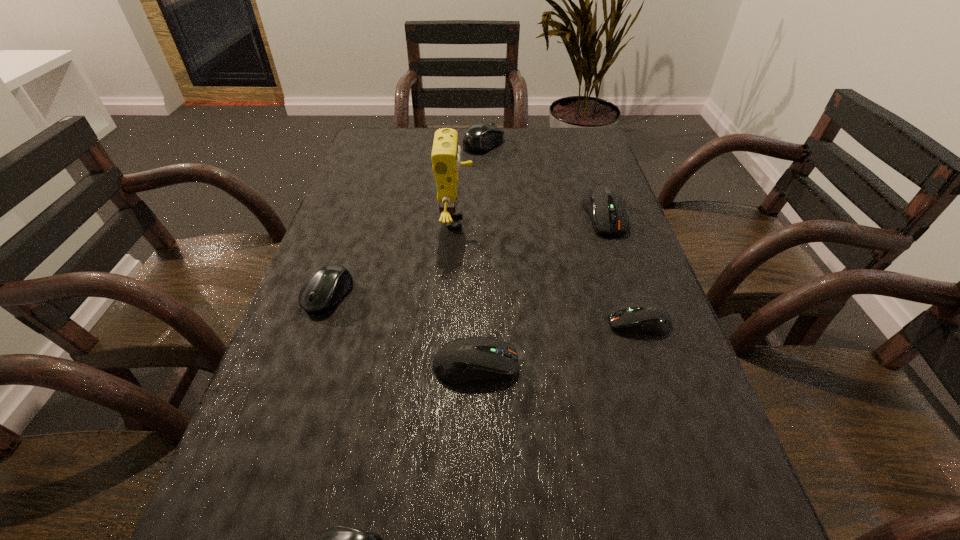
At what (x,y) coordinates should I click in order to perform the action: click on free spot located 0.180m on the face of the sponge. Please return your answer as a coordinate pair (x, y). The width and height of the screenshot is (960, 540). Looking at the image, I should click on (547, 222).

Locate an element on the screen. The width and height of the screenshot is (960, 540). vacant space positioned on the left of the farthest mouse is located at coordinates (369, 143).

Find the location of a particular element. free space located 0.130m on the button of the fifth nearest mouse is located at coordinates (626, 276).

You are a GUI agent. You are given a task and a screenshot of the screen. Output one action in this format:
    pyautogui.click(x=<x>, y=<y>)
    Task: Click on the vacant space located 0.370m on the front of the leftmost object
    The height and width of the screenshot is (540, 960).
    Given the screenshot: What is the action you would take?
    pyautogui.click(x=250, y=528)

Find the location of a particular element. The image size is (960, 540). free space located on the button of the second biggest dark computer equipment is located at coordinates (632, 365).

The width and height of the screenshot is (960, 540). Identify the location of vacant space located 0.140m on the button of the second farthest dark computer equipment. (535, 322).

Where is `vacant space located 0.310m on the button of the second farthest dark computer equipment`? The image size is (960, 540). vacant space located 0.310m on the button of the second farthest dark computer equipment is located at coordinates (446, 322).

The width and height of the screenshot is (960, 540). I want to click on vacant space located 0.140m on the button of the second farthest dark computer equipment, so click(535, 322).

In order to click on object that is positioned at the far edge in this screenshot , I will do point(480,137).

The width and height of the screenshot is (960, 540). In order to click on object located at the left edge in this screenshot , I will do `click(326, 287)`.